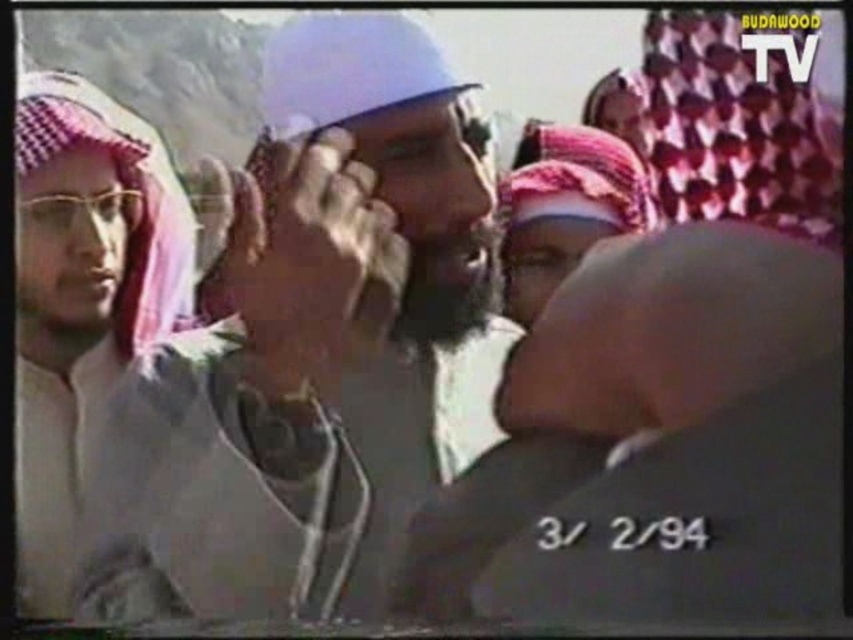
Question: Which of the following is the closest to the observer?

Choices:
 (A) white checkered headscarf at left
 (B) white matte headscarf at center

Answer: (A)

Question: Among these objects, which one is nearest to the camera?

Choices:
 (A) white checkered headscarf at left
 (B) white matte headscarf at center

Answer: (A)

Question: Does white matte headscarf at center lie behind white checkered headscarf at left?

Choices:
 (A) yes
 (B) no

Answer: (A)

Question: Which point is farther to the camera?

Choices:
 (A) (71, 506)
 (B) (386, 560)

Answer: (B)

Question: Is white matte headscarf at center behind white checkered headscarf at left?

Choices:
 (A) yes
 (B) no

Answer: (A)

Question: Is white matte headscarf at center behind white checkered headscarf at left?

Choices:
 (A) no
 (B) yes

Answer: (B)